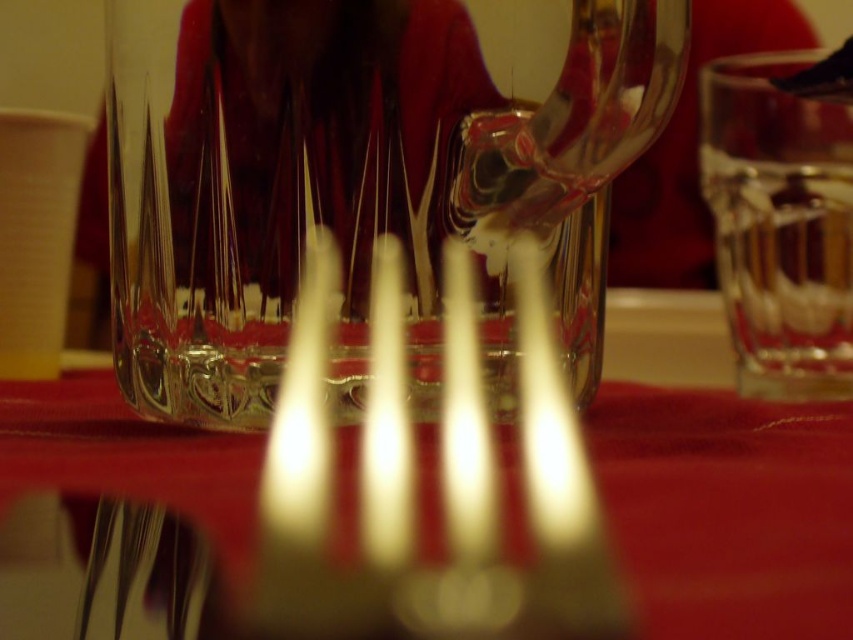
Who is lower down, clear glass wine glass at center or red velvet tablecloth at center?

red velvet tablecloth at center is below.

Can you confirm if clear glass wine glass at center is positioned above red velvet tablecloth at center?

Yes.

Is point (126, 13) more distant than point (785, 424)?

No, (126, 13) is in front of (785, 424).

Identify the location of clear glass wine glass at center. (355, 186).